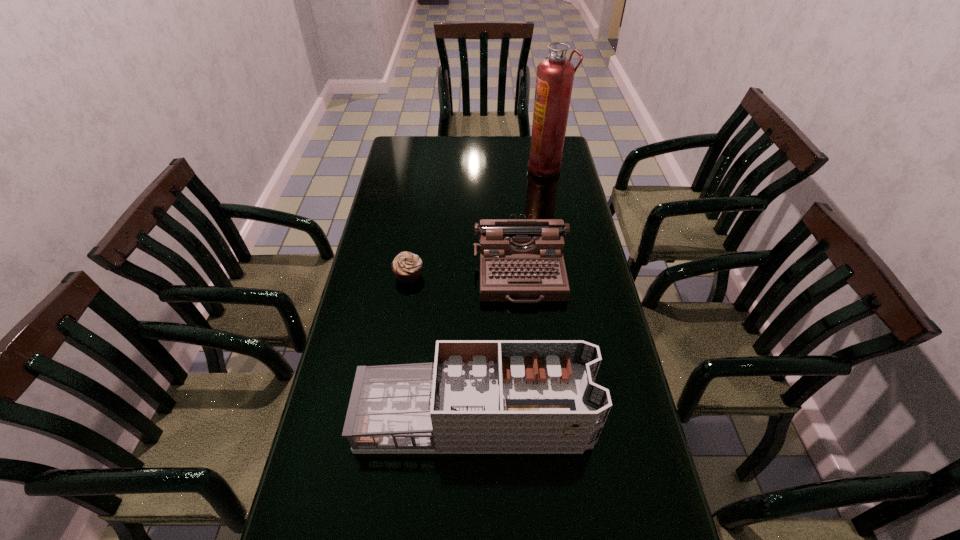
Find the location of a particular element. The image size is (960, 540). free space at the right edge is located at coordinates (612, 535).

Find the location of a particular element. The height and width of the screenshot is (540, 960). vacant point located between the shortest object and the farthest object is located at coordinates (477, 221).

The width and height of the screenshot is (960, 540). Identify the location of free space between the fire extinguisher and the shortest object. (477, 221).

I want to click on blank region between the farthest object and the shortest object, so click(x=477, y=221).

You are a GUI agent. You are given a task and a screenshot of the screen. Output one action in this format:
    pyautogui.click(x=<x>, y=<y>)
    Task: Click on the vacant area that lies between the typewriter and the muffin
    
    Given the screenshot: What is the action you would take?
    pyautogui.click(x=465, y=274)

Locate an element on the screen. vacant space that's between the tallest object and the shortest object is located at coordinates (477, 221).

This screenshot has height=540, width=960. Identify the location of the second closest object to the nearest object. (407, 266).

In order to click on the second closest object to the typewriter in this screenshot , I will do `click(479, 396)`.

This screenshot has width=960, height=540. Find the location of `vacant space that satisfies the following two spatial constraints: 1. on the side of the tallest object with the label; 2. on the keyboard of the second shortest object`. vacant space that satisfies the following two spatial constraints: 1. on the side of the tallest object with the label; 2. on the keyboard of the second shortest object is located at coordinates (566, 274).

The height and width of the screenshot is (540, 960). Identify the location of vacant space that satisfies the following two spatial constraints: 1. on the side of the fire extinguisher with the label; 2. on the front side of the muffin. (566, 275).